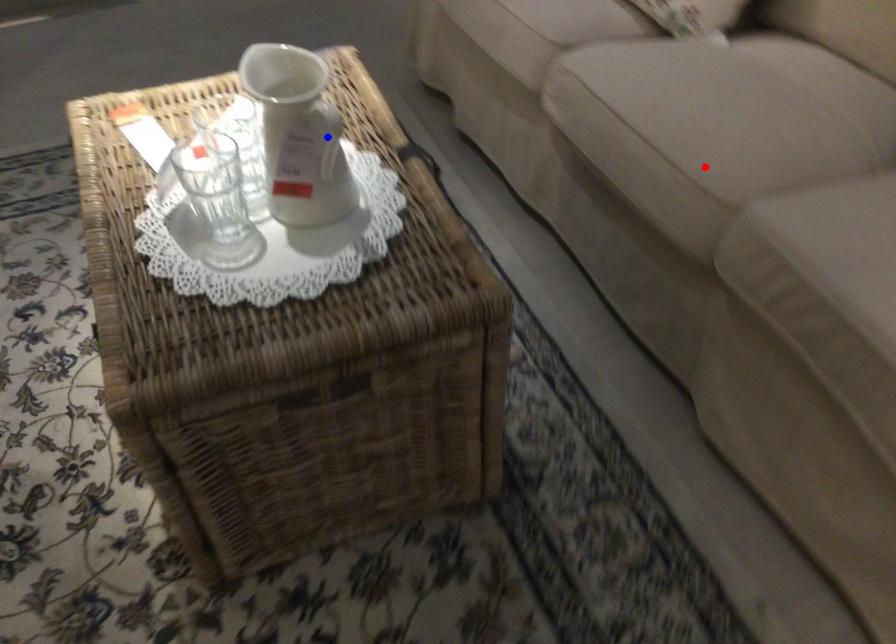
Question: Which of the two points in the image is closer to the camera?

Choices:
 (A) Blue point is closer.
 (B) Red point is closer.

Answer: (A)